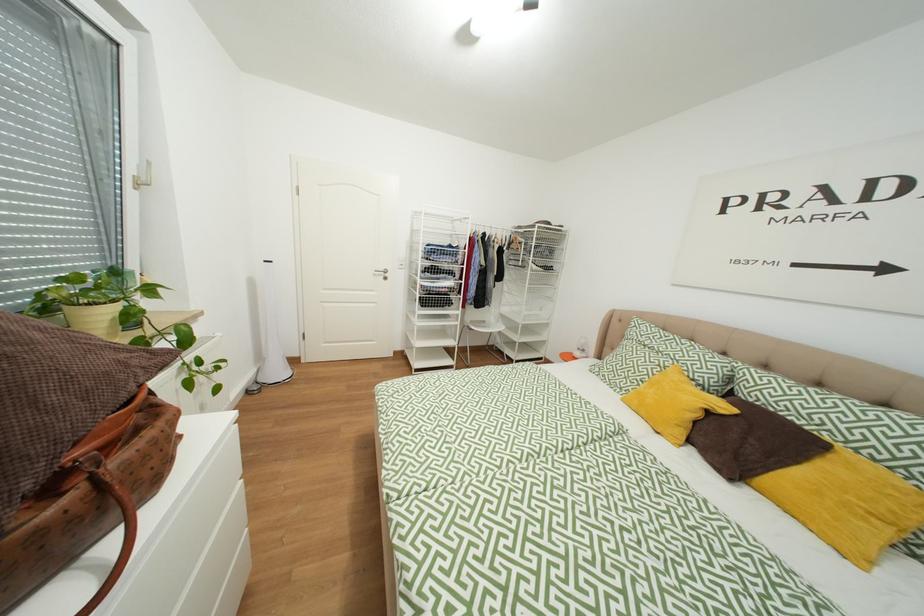
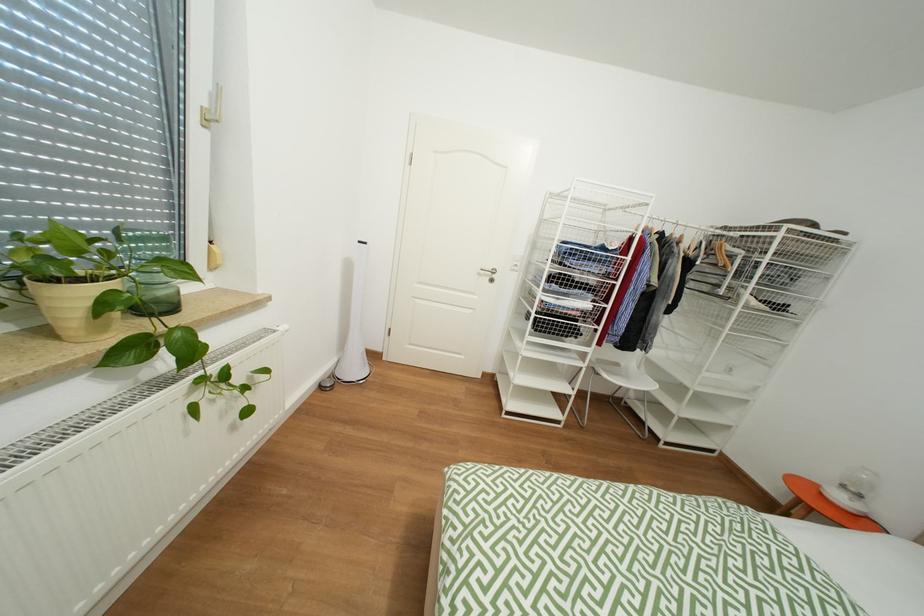
Question: The camera is either moving clockwise (left) or counter-clockwise (right) around the object. The first image is from the beginning of the video and the second image is from the end. Is the camera moving left or right when shooting the video?

Choices:
 (A) Left
 (B) Right

Answer: (B)